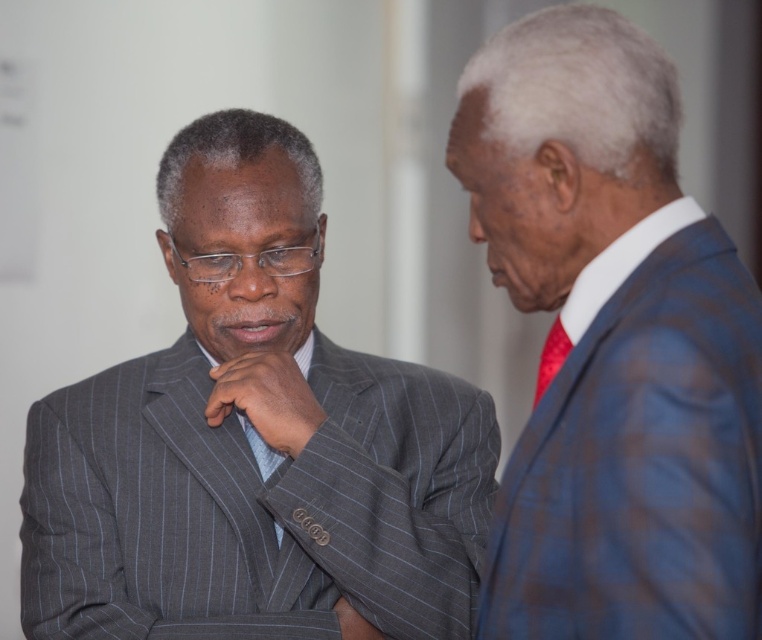
Who is taller, gray pinstripe suit at center or matte gray suit at left?

With more height is gray pinstripe suit at center.

Is point (242, 458) positioned after point (226, 330)?

Yes, it is.

Locate an element on the screen. This screenshot has width=762, height=640. gray pinstripe suit at center is located at coordinates (255, 496).

Is blue plaid suit at right thinner than matte gray suit at left?

In fact, blue plaid suit at right might be wider than matte gray suit at left.

Is point (597, 369) positioned behind point (245, 337)?

No, (597, 369) is in front of (245, 337).

What do you see at coordinates (612, 344) in the screenshot? I see `blue plaid suit at right` at bounding box center [612, 344].

The image size is (762, 640). I want to click on blue plaid suit at right, so click(612, 344).

Does point (591, 154) come farther from viewer compared to point (543, 348)?

No, (591, 154) is in front of (543, 348).

What do you see at coordinates (612, 344) in the screenshot? I see `blue plaid suit at right` at bounding box center [612, 344].

Where is `blue plaid suit at right`? Image resolution: width=762 pixels, height=640 pixels. blue plaid suit at right is located at coordinates (612, 344).